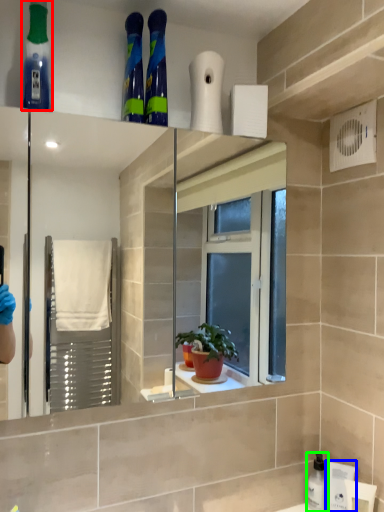
Question: Based on their relative distances, which object is nearer to mouthwash (highlighted by a red box)? Choose from toiletry (highlighted by a blue box) and cleaning product (highlighted by a green box).

Choices:
 (A) toiletry
 (B) cleaning product

Answer: (A)